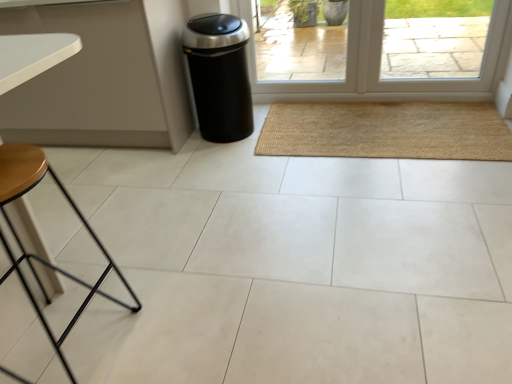
The width and height of the screenshot is (512, 384). I want to click on vacant area that lies between wooden stool at lower left and black matte trash can at center-left, so click(188, 199).